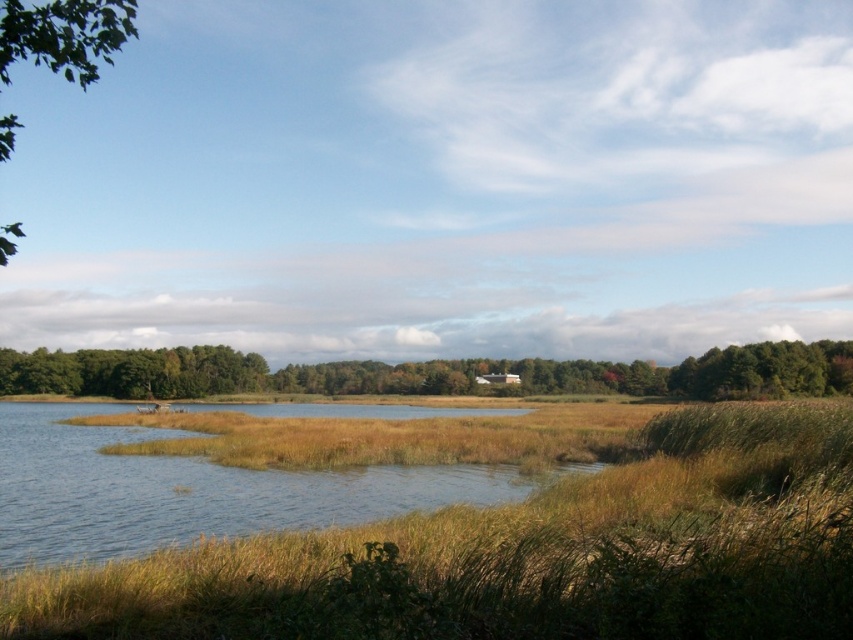
Which is below, brown grass at center or green leafy tree at upper left?

brown grass at center is lower down.

Is brown grass at center wider than green leafy tree at upper left?

No, brown grass at center is not wider than green leafy tree at upper left.

Where is `brown grass at center`? brown grass at center is located at coordinates (525, 556).

From the picture: Which is more to the right, brown grass at center or green leafy trees at center?

brown grass at center

Can you confirm if brown grass at center is positioned above green leafy trees at center?

Yes.

At what (x,y) coordinates should I click in order to perform the action: click on brown grass at center. Please return your answer as a coordinate pair (x, y). Image resolution: width=853 pixels, height=640 pixels. Looking at the image, I should click on (525, 556).

Does green leafy trees at center appear on the right side of green leafy tree at upper left?

Correct, you'll find green leafy trees at center to the right of green leafy tree at upper left.

Is the position of green leafy trees at center more distant than that of green leafy tree at upper left?

Yes, it is.

The image size is (853, 640). What do you see at coordinates (428, 372) in the screenshot?
I see `green leafy trees at center` at bounding box center [428, 372].

The height and width of the screenshot is (640, 853). Identify the location of green leafy trees at center. (428, 372).